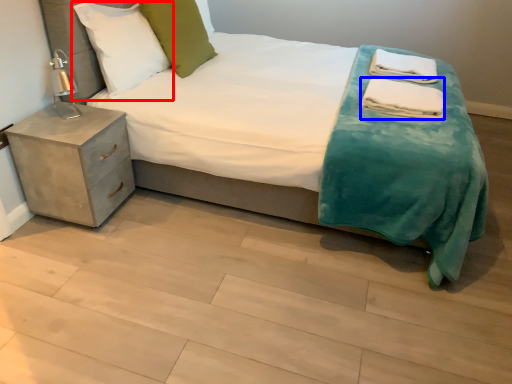
Question: Among these objects, which one is nearest to the camera, pillow (highlighted by a red box) or material (highlighted by a blue box)?

Choices:
 (A) pillow
 (B) material

Answer: (A)